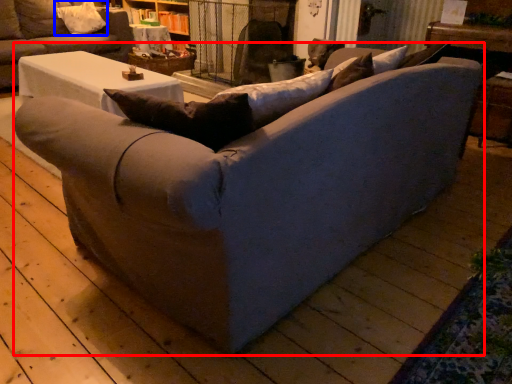
Question: Which of the following is the farthest to the observer, studio couch (highlighted by a red box) or pillow (highlighted by a blue box)?

Choices:
 (A) studio couch
 (B) pillow

Answer: (B)